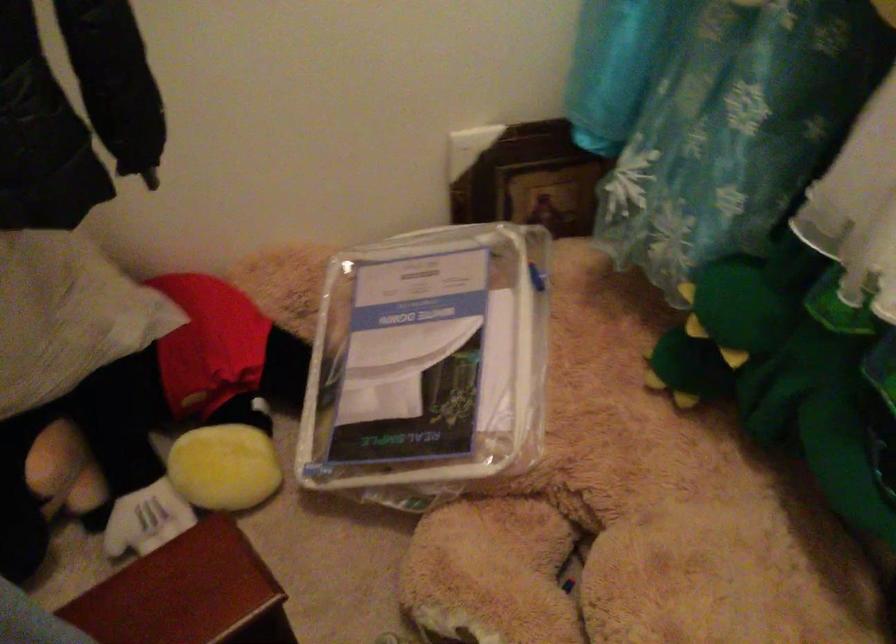
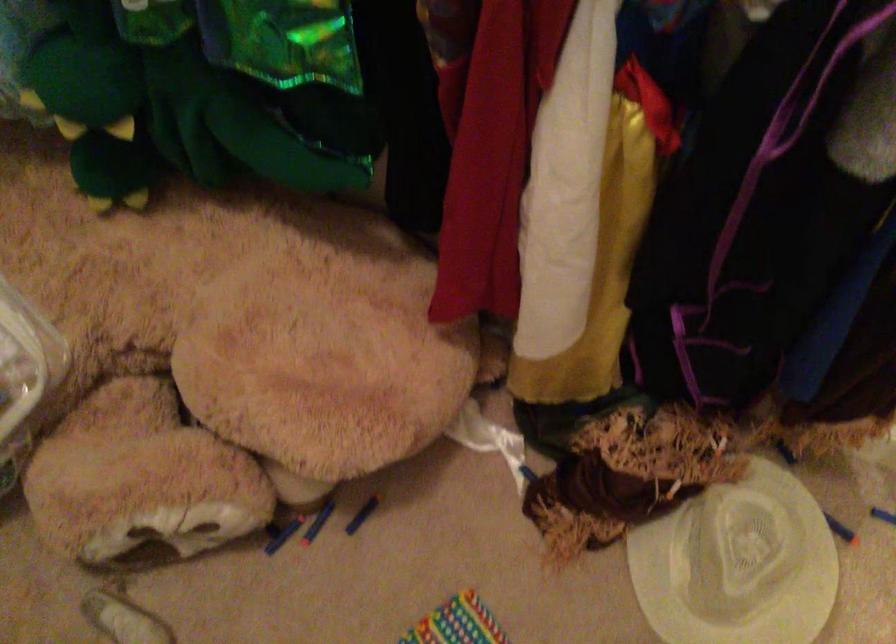
The images are taken continuously from a first-person perspective. In which direction is your viewpoint rotating?

The camera rotated toward right-down.